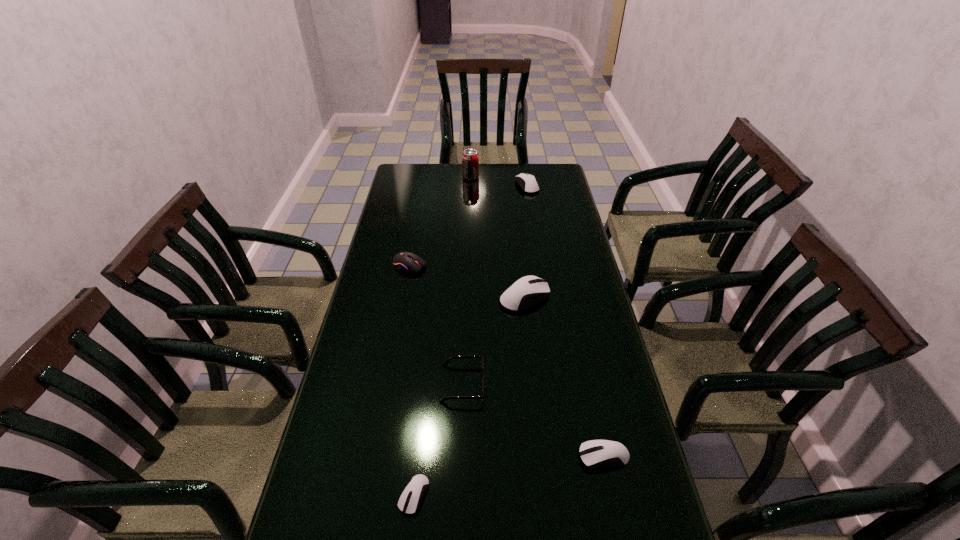
Identify the location of the shortest mouse. (410, 499).

This screenshot has width=960, height=540. Identify the location of the nearest object. (410, 499).

Identify the location of blank space located on the back of the soda can. (471, 167).

At what (x,y) coordinates should I click in order to perform the action: click on free spot located on the left of the third nearest white mouse. Please return your answer as a coordinate pair (x, y). The width and height of the screenshot is (960, 540). Looking at the image, I should click on (467, 296).

Image resolution: width=960 pixels, height=540 pixels. I want to click on vacant space located on the right of the second biggest white mouse, so click(x=552, y=186).

Find the location of a particular element. This screenshot has height=540, width=960. free spot located 0.180m on the back of the leftmost mouse is located at coordinates (417, 228).

At what (x,y) coordinates should I click in order to perform the action: click on free space located 0.270m on the front-facing side of the sunglasses. Please return your answer as a coordinate pair (x, y). Looking at the image, I should click on (583, 383).

You are a GUI agent. You are given a task and a screenshot of the screen. Output one action in this format:
    pyautogui.click(x=<x>, y=<y>)
    Task: Click on the vacant region located on the left of the second smallest white mouse
    
    Given the screenshot: What is the action you would take?
    pyautogui.click(x=467, y=456)

Locate an element on the screen. This screenshot has width=960, height=540. free space located 0.070m on the left of the shortest object is located at coordinates (369, 495).

At what (x,y) coordinates should I click in order to perform the action: click on soda can present at the far edge. Please return your answer as a coordinate pair (x, y). This screenshot has height=540, width=960. Looking at the image, I should click on (470, 159).